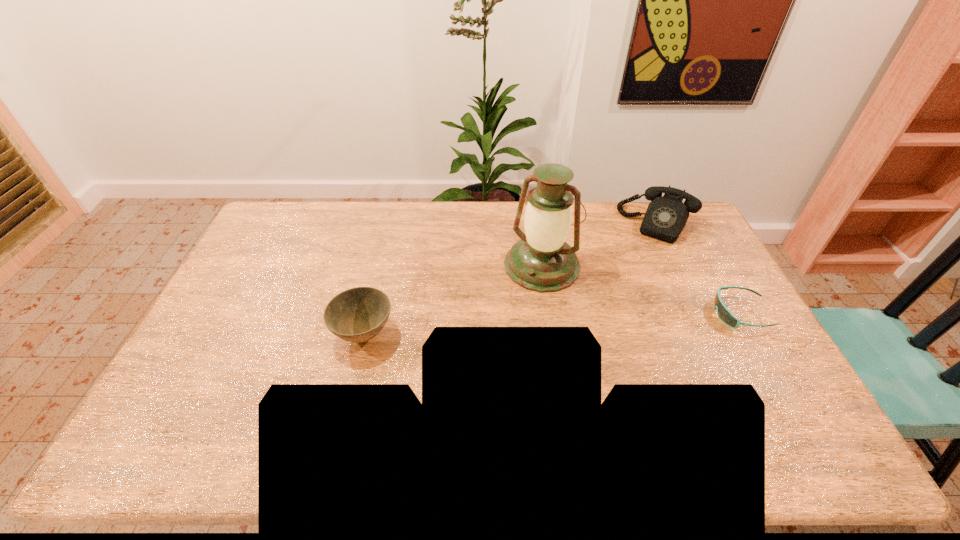
Find the location of a particular element. the leftmost object is located at coordinates pos(358,314).

Locate an element on the screen. The image size is (960, 540). the third tallest object is located at coordinates (x=358, y=314).

The image size is (960, 540). Find the location of `the shortest object`. the shortest object is located at coordinates (725, 315).

You are a GUI agent. You are given a task and a screenshot of the screen. Output one action in this format:
    pyautogui.click(x=<x>, y=<y>)
    Task: Click on the telephone
    This screenshot has height=540, width=960.
    Given the screenshot: What is the action you would take?
    coord(666,216)

Identify the location of the second object from left to right. (541, 261).

At what (x,y) coordinates should I click in order to perform the action: click on lantern. Please return your answer as a coordinate pair (x, y). Looking at the image, I should click on (541, 261).

Locate an element on the screen. This screenshot has height=540, width=960. vacant area situated on the back of the second shortest object is located at coordinates (377, 281).

This screenshot has height=540, width=960. Find the location of `blank space located on the front-facing side of the sunglasses`. blank space located on the front-facing side of the sunglasses is located at coordinates (660, 313).

The image size is (960, 540). In order to click on vacant space located on the front-facing side of the sunglasses in this screenshot , I will do `click(608, 313)`.

You are a GUI agent. You are given a task and a screenshot of the screen. Output one action in this format:
    pyautogui.click(x=<x>, y=<y>)
    Task: Click on the vacant space located on the front-facing side of the sunglasses
    The width and height of the screenshot is (960, 540).
    Given the screenshot: What is the action you would take?
    pyautogui.click(x=670, y=313)